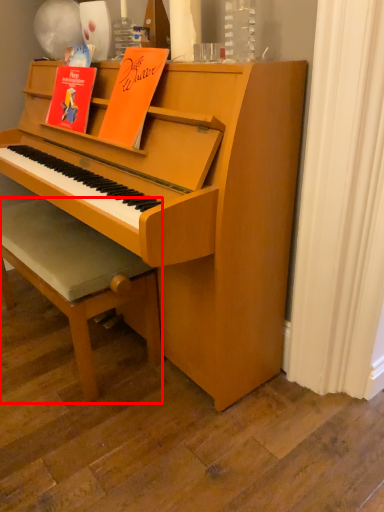
Question: From the image, what is the correct spatial relationship of footrest (annotated by the red box) in relation to paperback book?

Choices:
 (A) right
 (B) left

Answer: (B)